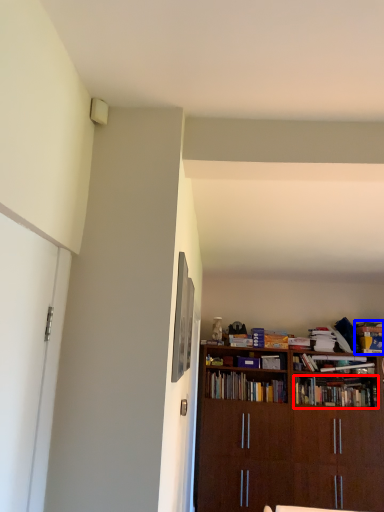
Question: Among these objects, which one is nearest to the camera, book (highlighted by a red box) or book (highlighted by a blue box)?

Choices:
 (A) book
 (B) book

Answer: (A)